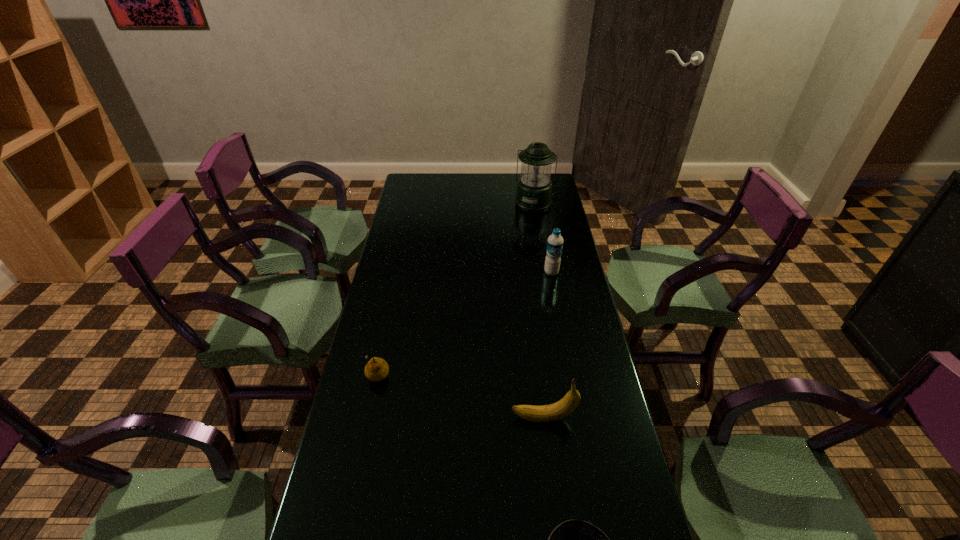
At what (x,y) coordinates should I click in order to perform the action: click on vacant space located 0.190m at the start of the peel on the banana. Please return your answer as a coordinate pair (x, y). Looking at the image, I should click on (443, 418).

The width and height of the screenshot is (960, 540). I want to click on vacant space located 0.370m on the back of the fourth tallest object, so coord(397,283).

I want to click on object present at the far edge, so click(534, 189).

The width and height of the screenshot is (960, 540). I want to click on object that is at the left edge, so click(x=377, y=369).

You are a GUI agent. You are given a task and a screenshot of the screen. Output one action in this format:
    pyautogui.click(x=<x>, y=<y>)
    Task: Click on the lantern positioned at the right edge
    
    Given the screenshot: What is the action you would take?
    (x=534, y=189)

This screenshot has width=960, height=540. In order to click on water bottle positioned at the right edge in this screenshot , I will do `click(555, 241)`.

Find the location of a particular element. The width and height of the screenshot is (960, 540). banana at the right edge is located at coordinates (562, 408).

Find the location of a particular element. The image size is (960, 540). object positioned at the far right corner is located at coordinates (534, 189).

Locate an element on the screen. The width and height of the screenshot is (960, 540). blank space at the left edge of the desktop is located at coordinates (392, 423).

The image size is (960, 540). In order to click on vacant area at the right edge in this screenshot , I will do `click(564, 316)`.